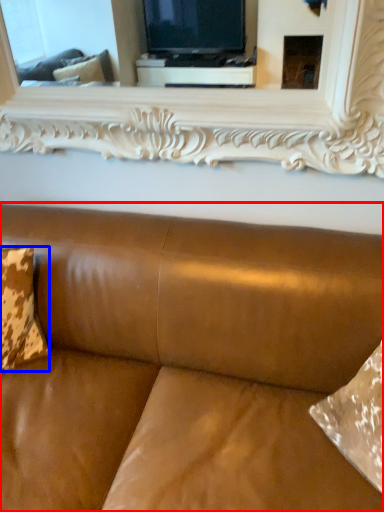
Question: Which object is further to the camera taking this photo, studio couch (highlighted by a red box) or pillow (highlighted by a blue box)?

Choices:
 (A) studio couch
 (B) pillow

Answer: (B)